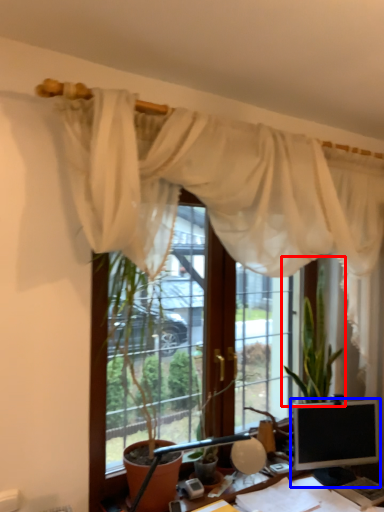
Question: Which object is closer to the camera taking this photo, houseplant (highlighted by a red box) or computer monitor (highlighted by a blue box)?

Choices:
 (A) houseplant
 (B) computer monitor

Answer: (B)